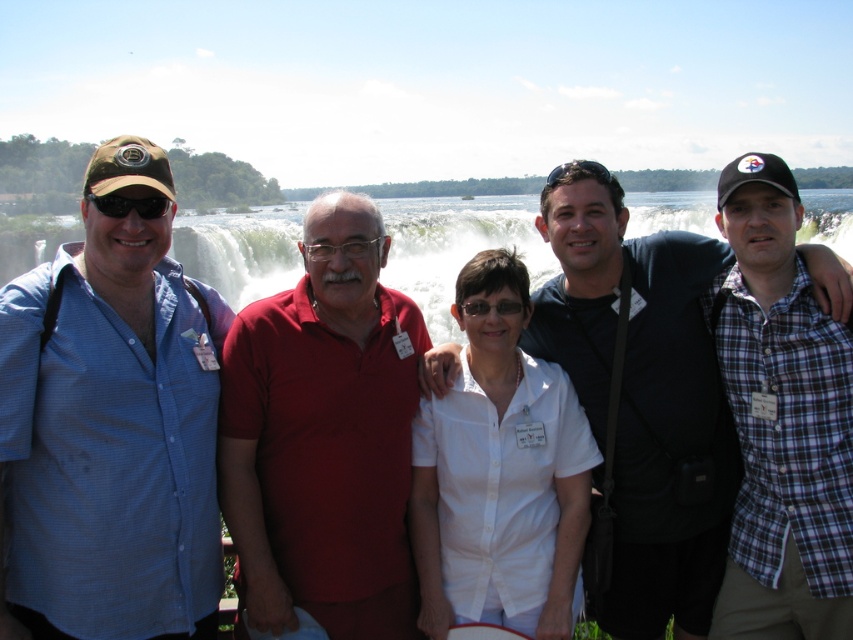
Question: Does blue checkered shirt at left appear over white matte shirt at center?

Choices:
 (A) yes
 (B) no

Answer: (A)

Question: Which point is closer to the camera?

Choices:
 (A) (685, 426)
 (B) (752, 490)
 (C) (287, 470)

Answer: (C)

Question: Which point is closer to the camera?

Choices:
 (A) plaid cotton shirt at right
 (B) dark blue shirt at center
 (C) white matte shirt at center
 (D) blue checkered shirt at left

Answer: (D)

Question: Is red matte shirt at center below dark blue shirt at center?

Choices:
 (A) no
 (B) yes

Answer: (B)

Question: Does blue checkered shirt at left appear on the right side of red matte shirt at center?

Choices:
 (A) yes
 (B) no

Answer: (B)

Question: Which point appears closest to the camera in this image?

Choices:
 (A) (549, 577)
 (B) (56, 522)

Answer: (B)